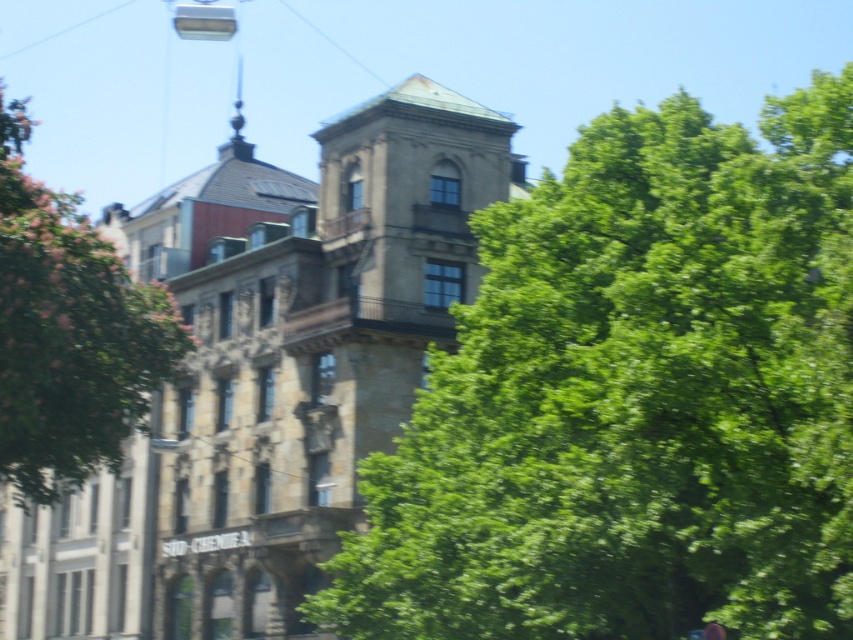
Consider the image. Who is positioned more to the right, green leafy tree at center or stone textured bell tower at center?

From the viewer's perspective, green leafy tree at center appears more on the right side.

Can you confirm if green leafy tree at center is bigger than stone textured bell tower at center?

Indeed, green leafy tree at center has a larger size compared to stone textured bell tower at center.

Identify the location of green leafy tree at center. (635, 401).

Between point (791, 208) and point (22, 132), which one is positioned in front?

Point (791, 208)

Does point (845, 166) come closer to viewer compared to point (13, 467)?

Yes, it is.

The width and height of the screenshot is (853, 640). I want to click on green leafy tree at center, so pyautogui.click(x=635, y=401).

Between stone textured bell tower at center and green leafy tree at left, which one appears on the left side from the viewer's perspective?

green leafy tree at left is more to the left.

Does stone textured bell tower at center have a greater width compared to green leafy tree at left?

No, stone textured bell tower at center is not wider than green leafy tree at left.

Between point (376, 180) and point (32, 449), which one is positioned in front?

Point (32, 449) is more forward.

Locate an element on the screen. stone textured bell tower at center is located at coordinates (387, 264).